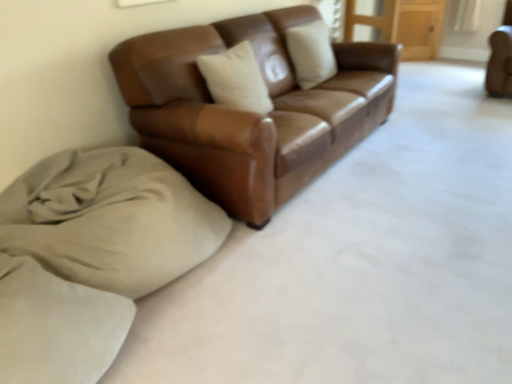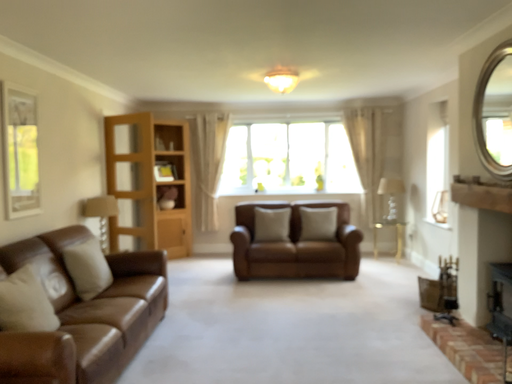
Question: How did the camera likely rotate when shooting the video?

Choices:
 (A) rotated upward
 (B) rotated downward

Answer: (A)